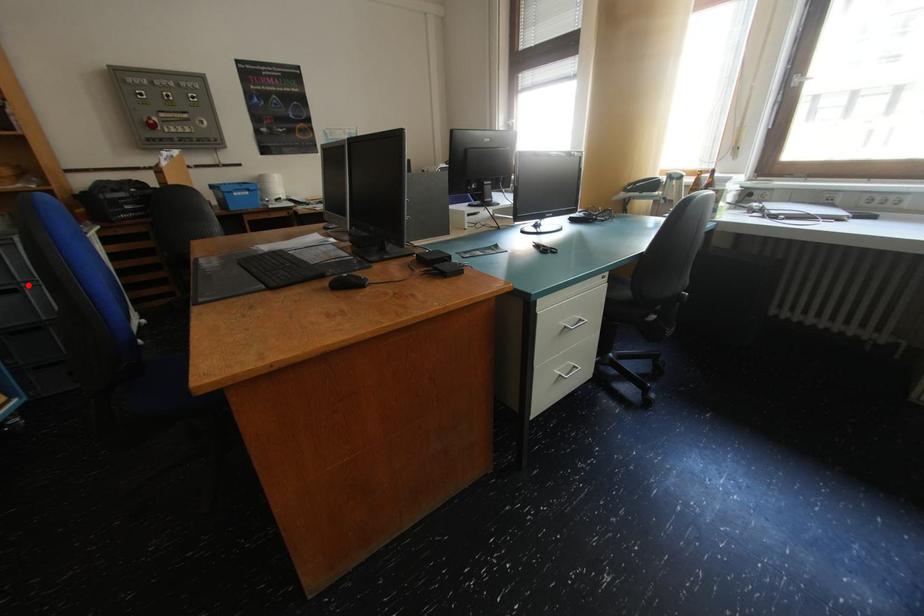
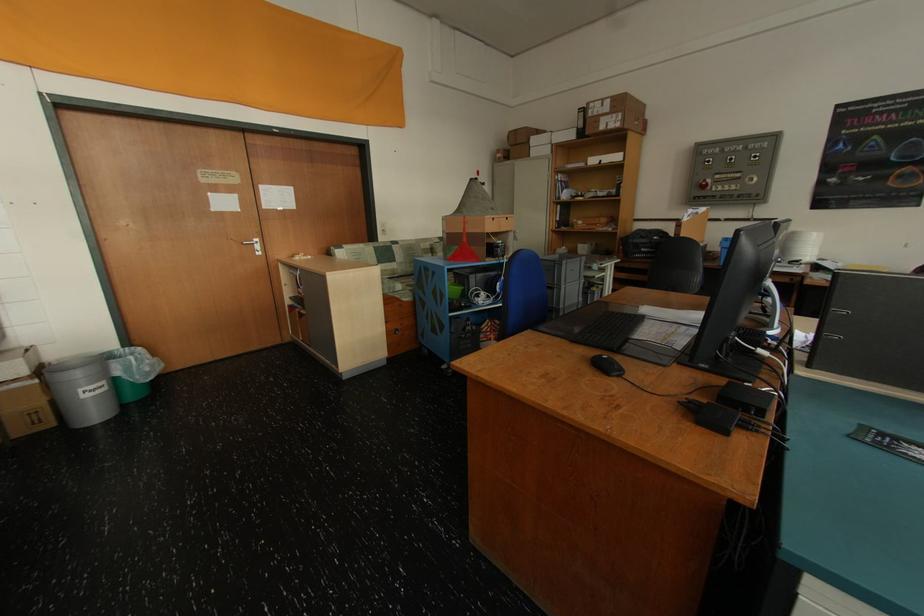
Question: I am providing you with two images of the same scene from different viewpoints. Image1 has a red point marked. In image2, the corresponding 3D location appears at what relative position? Reply with the corresponding letter.

Choices:
 (A) Closer
 (B) Farther

Answer: (A)